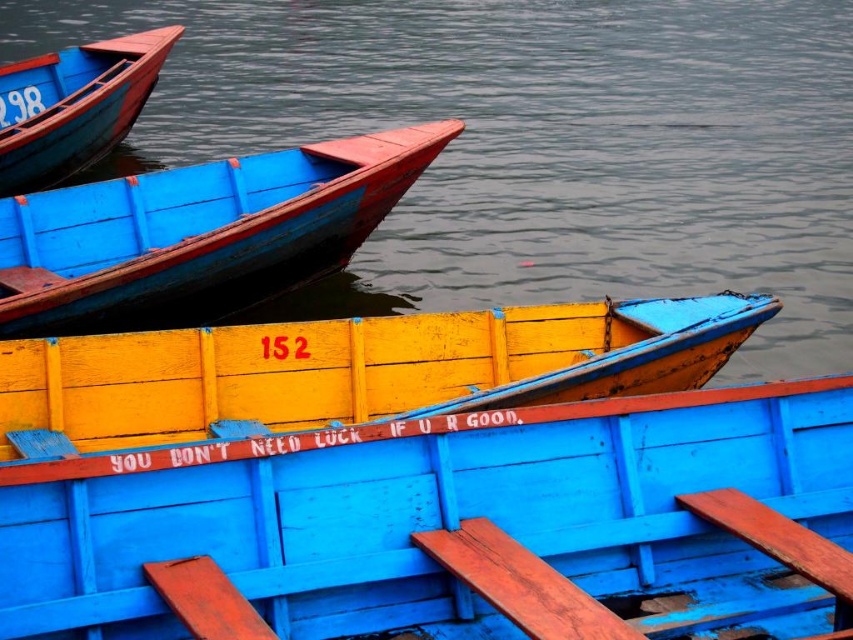
This screenshot has width=853, height=640. I want to click on smooth water at boat center, so click(532, 145).

Measure the distance between smooth water at boat center and wooden canoe at center.

They are 7.30 meters apart.

Is point (621, 188) closer to viewer compared to point (635, 300)?

No, (621, 188) is further to viewer.

Identify the location of smooth water at boat center. (532, 145).

Which is more to the right, smooth water at boat center or matte blue boat at upper left?

smooth water at boat center

What do you see at coordinates (532, 145) in the screenshot? I see `smooth water at boat center` at bounding box center [532, 145].

Where is `smooth water at boat center`? This screenshot has height=640, width=853. smooth water at boat center is located at coordinates point(532,145).

Is point (775, 458) farther from viewer compared to point (135, 234)?

That is False.

Does point (595, 484) come closer to viewer compared to point (265, 291)?

That is True.

Locate an element on the screen. matte blue wooden boat at center is located at coordinates (456, 528).